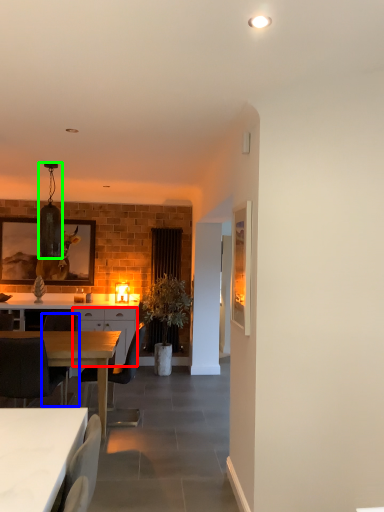
Question: Which object is the closest to the cabinetry (highlighted by a red box)? Choose among these: chair (highlighted by a blue box) or lamp (highlighted by a green box).

Choices:
 (A) chair
 (B) lamp

Answer: (A)